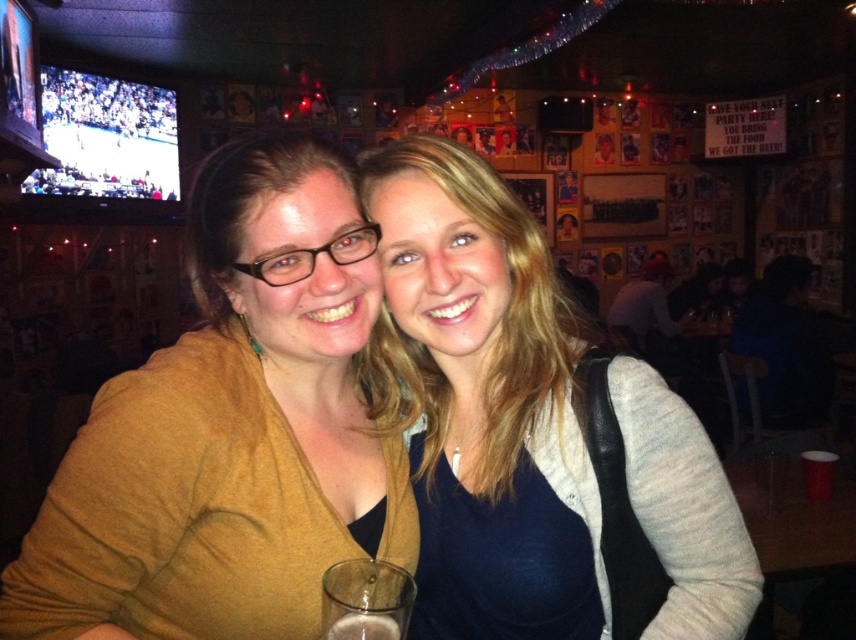
Question: Among these points, which one is farthest from the camera?

Choices:
 (A) (27, 534)
 (B) (331, 632)
 (C) (449, 392)
 (D) (367, 568)

Answer: (C)

Question: Can you confirm if matte yellow sweater at center is thinner than translucent glass at lower center?

Choices:
 (A) no
 (B) yes

Answer: (A)

Question: Can you confirm if matte gray sweater at center is wider than translucent glass at lower center?

Choices:
 (A) yes
 (B) no

Answer: (A)

Question: Which object is positioned closest to the matte gray sweater at center?

Choices:
 (A) clear glass at lower center
 (B) matte yellow sweater at center

Answer: (B)

Question: Which object appears closest to the camera in this image?

Choices:
 (A) matte gray sweater at center
 (B) clear glass at lower center
 (C) matte yellow sweater at center
 (D) translucent glass at lower center

Answer: (B)

Question: Can you confirm if matte gray sweater at center is thinner than clear glass at lower center?

Choices:
 (A) yes
 (B) no

Answer: (B)